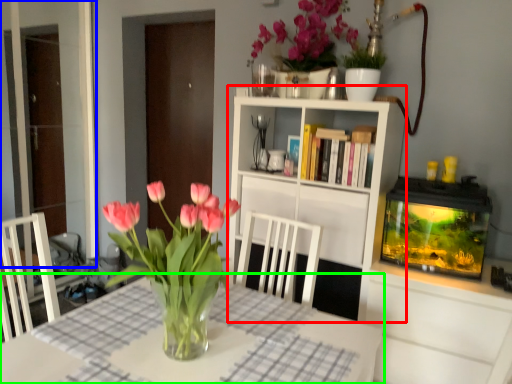
Question: Which object is positioned closest to cabinetry (highlighted by a red box)? Select from glass door (highlighted by a blue box) and table (highlighted by a green box).

Choices:
 (A) glass door
 (B) table

Answer: (B)